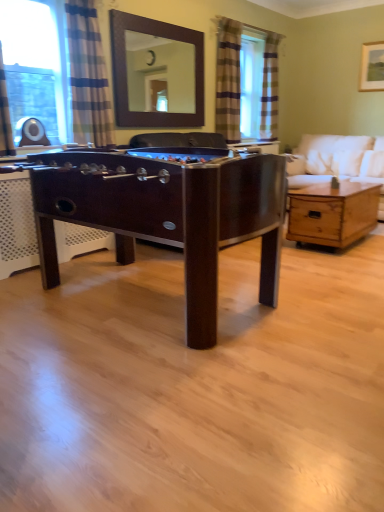
Locate an element on the screen. white fabric couch at right is located at coordinates (338, 161).

Looking at this image, measure the distance between point (136, 213) and camera.

A distance of 6.81 feet exists between point (136, 213) and camera.

Find the location of `wooden coffee table at center`. wooden coffee table at center is located at coordinates (332, 213).

What do you see at coordinates (160, 74) in the screenshot? I see `brown wooden mirror at upper center` at bounding box center [160, 74].

This screenshot has width=384, height=512. What do you see at coordinates (88, 76) in the screenshot? I see `blue striped curtain at upper left, which is the 3th curtain from right to left` at bounding box center [88, 76].

What is the approximate height of blue striped curtain at left?

blue striped curtain at left is 1.16 meters tall.

Find the location of a particular element. striped fabric curtain at right, placed as the first curtain when sorted from back to front is located at coordinates (270, 88).

Locate an element on the screen. This screenshot has height=512, width=384. plaid fabric curtain at upper right, marked as the second curtain in a right-to-left arrangement is located at coordinates (228, 80).

At what (x,y) coordinates should I click in order to perform the action: click on white fabric couch at right. Please return your answer as a coordinate pair (x, y). The height and width of the screenshot is (512, 384). Looking at the image, I should click on (338, 161).

Which of these two, wooden picture frame at upper right or wooden coffee table at center, is wider?

wooden coffee table at center is wider.

Would you consider wooden picture frame at upper right to be distant from wooden coffee table at center?

Indeed, wooden picture frame at upper right is not near wooden coffee table at center.

Based on the photo, how many degrees apart are the facing directions of wooden picture frame at upper right and wooden coffee table at center?

90.1 degrees separate the facing orientations of wooden picture frame at upper right and wooden coffee table at center.

Looking at this image, is wooden picture frame at upper right bigger than wooden coffee table at center?

No, wooden picture frame at upper right is not bigger than wooden coffee table at center.

Locate an element on the screen. desk on the left of striped fabric curtain at right, the 1th curtain in the right-to-left sequence is located at coordinates (168, 213).

Is dark wood foosball table at center next to striped fabric curtain at right, placed as the first curtain when sorted from back to front, and touching it?

dark wood foosball table at center is not next to striped fabric curtain at right, placed as the first curtain when sorted from back to front, and they're not touching.

Based on the photo, who is bigger, dark wood foosball table at center or striped fabric curtain at right, marked as the third curtain in a front-to-back arrangement?

dark wood foosball table at center is bigger.

Is point (42, 240) positioned behind point (266, 119)?

No, (42, 240) is in front of (266, 119).

Find the location of a particular element. The width and height of the screenshot is (384, 512). curtain that is the 1st one above the blue striped curtain at upper left, which is the 3th curtain from right to left (from a real-world perspective) is located at coordinates (228, 80).

From a real-world perspective, which is physically below, blue striped curtain at upper left, which is the 3th curtain from right to left, or plaid fabric curtain at upper right, marked as the second curtain in a right-to-left arrangement?

In real-world perspective, blue striped curtain at upper left, which is the 3th curtain from right to left, is lower.

Does blue striped curtain at upper left, which is the first curtain in front-to-back order, lie in front of plaid fabric curtain at upper right, marked as the second curtain in a right-to-left arrangement?

Yes.

Is point (89, 106) closer or farther from the camera than point (237, 114)?

Point (89, 106) is closer to the camera than point (237, 114).

Relative to plaid fabric curtain at upper right, the 2th curtain in the front-to-back sequence, is brown wooden mirror at upper center in front or behind?

Clearly, brown wooden mirror at upper center is in front of plaid fabric curtain at upper right, the 2th curtain in the front-to-back sequence.

Based on their positions, is brown wooden mirror at upper center located to the left or right of plaid fabric curtain at upper right, marked as the second curtain in a right-to-left arrangement?

From the image, it's evident that brown wooden mirror at upper center is to the left of plaid fabric curtain at upper right, marked as the second curtain in a right-to-left arrangement.

Can you confirm if brown wooden mirror at upper center is smaller than plaid fabric curtain at upper right, marked as the second curtain in a right-to-left arrangement?

Correct, brown wooden mirror at upper center occupies less space than plaid fabric curtain at upper right, marked as the second curtain in a right-to-left arrangement.

Can you confirm if brown wooden mirror at upper center is thinner than plaid fabric curtain at upper right, marked as the second curtain in a left-to-right arrangement?

Yes, brown wooden mirror at upper center is thinner than plaid fabric curtain at upper right, marked as the second curtain in a left-to-right arrangement.

Is striped fabric curtain at right, marked as the 3th curtain in a left-to-right arrangement, to the right of blue striped curtain at left from the viewer's perspective?

Yes.

Is striped fabric curtain at right, marked as the third curtain in a front-to-back arrangement, facing away from blue striped curtain at left?

striped fabric curtain at right, marked as the third curtain in a front-to-back arrangement, does not have its back to blue striped curtain at left.

From the image's perspective, between striped fabric curtain at right, placed as the first curtain when sorted from back to front, and blue striped curtain at left, which one is located above?

striped fabric curtain at right, placed as the first curtain when sorted from back to front, is shown above in the image.

Is striped fabric curtain at right, the 1th curtain in the right-to-left sequence, spatially inside blue striped curtain at left, or outside of it?

striped fabric curtain at right, the 1th curtain in the right-to-left sequence, is spatially situated outside blue striped curtain at left.

From the image's perspective, does plaid fabric curtain at upper right, marked as the second curtain in a left-to-right arrangement, appear lower than striped fabric curtain at right, placed as the first curtain when sorted from back to front?

Yes, from the image's perspective, plaid fabric curtain at upper right, marked as the second curtain in a left-to-right arrangement, is below striped fabric curtain at right, placed as the first curtain when sorted from back to front.

Considering the sizes of objects plaid fabric curtain at upper right, marked as the second curtain in a left-to-right arrangement, and striped fabric curtain at right, marked as the third curtain in a front-to-back arrangement, in the image provided, who is shorter, plaid fabric curtain at upper right, marked as the second curtain in a left-to-right arrangement, or striped fabric curtain at right, marked as the third curtain in a front-to-back arrangement,?

striped fabric curtain at right, marked as the third curtain in a front-to-back arrangement.

Is plaid fabric curtain at upper right, marked as the second curtain in a right-to-left arrangement, in front of striped fabric curtain at right, marked as the third curtain in a front-to-back arrangement?

Yes, it is.

Is plaid fabric curtain at upper right, which ranks as the 2th curtain in back-to-front order, thinner than striped fabric curtain at right, marked as the third curtain in a front-to-back arrangement?

Correct, the width of plaid fabric curtain at upper right, which ranks as the 2th curtain in back-to-front order, is less than that of striped fabric curtain at right, marked as the third curtain in a front-to-back arrangement.

Image resolution: width=384 pixels, height=512 pixels. I want to click on mirror in front of the striped fabric curtain at right, the 1th curtain in the right-to-left sequence, so click(x=160, y=74).

Could you tell me if brown wooden mirror at upper center is facing striped fabric curtain at right, marked as the 3th curtain in a left-to-right arrangement?

No, brown wooden mirror at upper center is not facing towards striped fabric curtain at right, marked as the 3th curtain in a left-to-right arrangement.

Based on the photo, between brown wooden mirror at upper center and striped fabric curtain at right, marked as the 3th curtain in a left-to-right arrangement, which one has smaller size?

Smaller between the two is brown wooden mirror at upper center.

Locate an element on the screen. The height and width of the screenshot is (512, 384). picture frame that appears behind the wooden coffee table at center is located at coordinates (372, 67).

Locate an element on the screen. desk that is on the left side of striped fabric curtain at right, the 1th curtain in the right-to-left sequence is located at coordinates (168, 213).

Looking at the image, which one is located closer to brown wooden mirror at upper center, wooden picture frame at upper right or striped fabric curtain at right, the 1th curtain in the right-to-left sequence?

striped fabric curtain at right, the 1th curtain in the right-to-left sequence, is closer to brown wooden mirror at upper center.

When comparing their distances from plaid fabric curtain at upper right, marked as the second curtain in a right-to-left arrangement, does dark wood foosball table at center or striped fabric curtain at right, placed as the first curtain when sorted from back to front, seem further?

dark wood foosball table at center lies further to plaid fabric curtain at upper right, marked as the second curtain in a right-to-left arrangement, than the other object.

Estimate the real-world distances between objects in this image. Which object is further from striped fabric curtain at right, marked as the third curtain in a front-to-back arrangement, wooden coffee table at center or blue striped curtain at upper left, which is the third curtain from back to front?

Based on the image, blue striped curtain at upper left, which is the third curtain from back to front, appears to be further to striped fabric curtain at right, marked as the third curtain in a front-to-back arrangement.

When comparing their distances from plaid fabric curtain at upper right, marked as the second curtain in a left-to-right arrangement, does blue striped curtain at upper left, which is the first curtain in front-to-back order, or brown wooden mirror at upper center seem further?

The object further to plaid fabric curtain at upper right, marked as the second curtain in a left-to-right arrangement, is blue striped curtain at upper left, which is the first curtain in front-to-back order.

In the scene shown: Which object lies nearer to the anchor point plaid fabric curtain at upper right, marked as the second curtain in a left-to-right arrangement, blue striped curtain at upper left, which is the first curtain in front-to-back order, or wooden coffee table at center?

wooden coffee table at center is positioned closer to the anchor plaid fabric curtain at upper right, marked as the second curtain in a left-to-right arrangement.

Estimate the real-world distances between objects in this image. Which object is closer to wooden picture frame at upper right, white fabric couch at right or dark wood foosball table at center?

white fabric couch at right is positioned closer to the anchor wooden picture frame at upper right.

Looking at the image, which one is located further to striped fabric curtain at right, the 1th curtain in the right-to-left sequence, wooden coffee table at center or brown wooden mirror at upper center?

wooden coffee table at center lies further to striped fabric curtain at right, the 1th curtain in the right-to-left sequence, than the other object.

Based on their spatial positions, is plaid fabric curtain at upper right, which ranks as the 2th curtain in back-to-front order, or striped fabric curtain at right, the 1th curtain in the right-to-left sequence, further from blue striped curtain at upper left, which is the 3th curtain from right to left?

striped fabric curtain at right, the 1th curtain in the right-to-left sequence.

Identify the location of mirror between blue striped curtain at left and plaid fabric curtain at upper right, marked as the second curtain in a right-to-left arrangement. Image resolution: width=384 pixels, height=512 pixels. (160, 74).

What are the coordinates of `coffee table located between brown wooden mirror at upper center and white fabric couch at right in the left-right direction` in the screenshot? It's located at (332, 213).

You are a GUI agent. You are given a task and a screenshot of the screen. Output one action in this format:
    pyautogui.click(x=<x>, y=<y>)
    Task: Click on the mirror between blue striped curtain at upper left, which is the first curtain in front-to-back order, and plaid fabric curtain at upper right, marked as the second curtain in a right-to-left arrangement, in the front-back direction
    
    Given the screenshot: What is the action you would take?
    pyautogui.click(x=160, y=74)

Find the location of a particular element. mirror located between blue striped curtain at upper left, which is the third curtain from back to front, and striped fabric curtain at right, placed as the first curtain when sorted from back to front, in the depth direction is located at coordinates (160, 74).